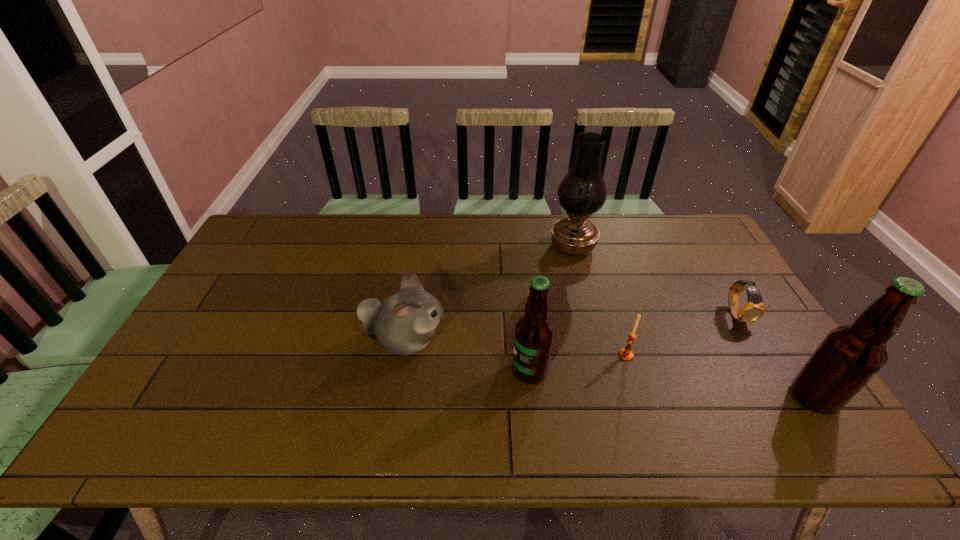
Find the location of a particular element. This screenshot has width=960, height=540. blank area at the near edge is located at coordinates (416, 408).

This screenshot has height=540, width=960. Find the location of `free location at the left edge of the desktop`. free location at the left edge of the desktop is located at coordinates (248, 270).

This screenshot has height=540, width=960. In the image, there is a desktop. Identify the location of free space at the far right corner. (687, 239).

In order to click on free point between the right beer bottle and the fifth tallest object in this screenshot , I will do `click(720, 376)`.

Image resolution: width=960 pixels, height=540 pixels. In order to click on vacant area that lies between the candle_holder and the oil lamp in this screenshot , I will do `click(599, 301)`.

Identify the location of vacant space that is in between the watch and the fourth tallest object. (571, 327).

Where is `empty space between the left beer bottle and the taller beer bottle`? empty space between the left beer bottle and the taller beer bottle is located at coordinates (672, 384).

The width and height of the screenshot is (960, 540). What are the coordinates of `empty space that is in between the watch and the farthest object` in the screenshot? It's located at (655, 281).

The width and height of the screenshot is (960, 540). In order to click on free space between the hamster and the watch in this screenshot , I will do `click(571, 327)`.

The height and width of the screenshot is (540, 960). In order to click on vacant space in between the fifth tallest object and the taller beer bottle in this screenshot , I will do `click(720, 376)`.